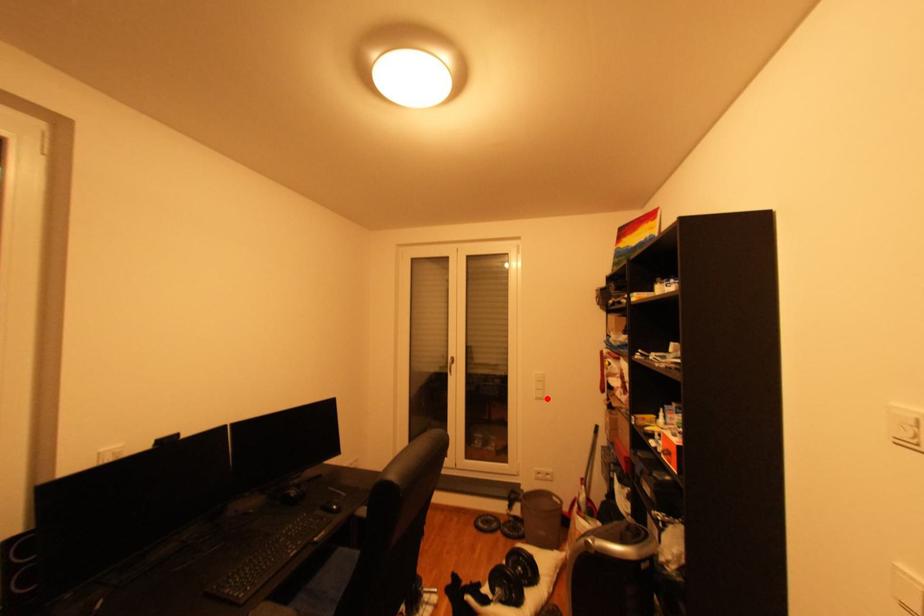
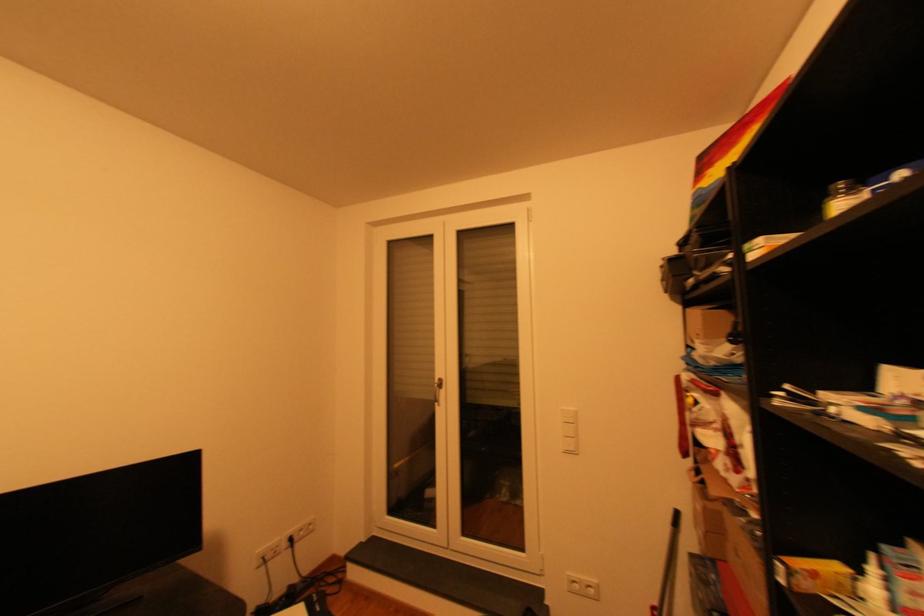
In the second image, find the point that corresponds to the highlighted location in the first image.

(576, 453)